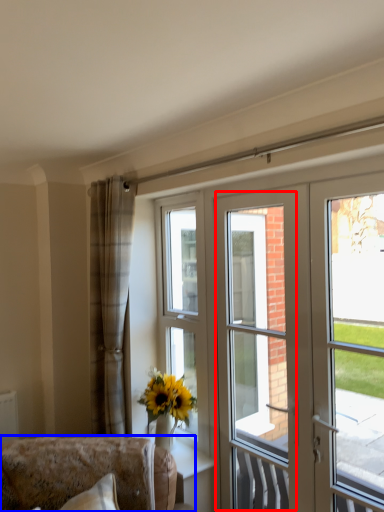
Question: Among these objects, which one is nearest to the camera, screen door (highlighted by a red box) or furniture (highlighted by a blue box)?

Choices:
 (A) screen door
 (B) furniture

Answer: (B)